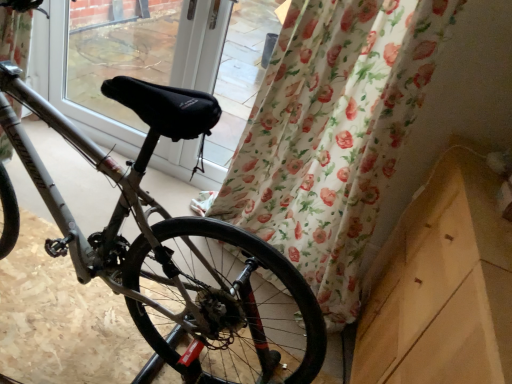
Question: Is floral fabric curtain at lower right surrounded by silver metallic bicycle wheel at lower left?

Choices:
 (A) no
 (B) yes

Answer: (A)

Question: From a real-world perspective, does silver metallic bicycle wheel at lower left sit lower than floral fabric curtain at lower right?

Choices:
 (A) yes
 (B) no

Answer: (A)

Question: Can you confirm if silver metallic bicycle wheel at lower left is taller than floral fabric curtain at lower right?

Choices:
 (A) no
 (B) yes

Answer: (A)

Question: Is silver metallic bicycle wheel at lower left far from floral fabric curtain at lower right?

Choices:
 (A) yes
 (B) no

Answer: (B)

Question: Does silver metallic bicycle wheel at lower left come behind floral fabric curtain at lower right?

Choices:
 (A) yes
 (B) no

Answer: (A)

Question: Is point (217, 61) positioned closer to the camera than point (294, 332)?

Choices:
 (A) farther
 (B) closer

Answer: (A)

Question: Considering the positions of black fabric at center and silver metallic bicycle wheel at lower left in the image, is black fabric at center wider or thinner than silver metallic bicycle wheel at lower left?

Choices:
 (A) thin
 (B) wide

Answer: (A)

Question: From the image's perspective, is black fabric at center positioned above or below silver metallic bicycle wheel at lower left?

Choices:
 (A) above
 (B) below

Answer: (A)

Question: In the image, is black fabric at center on the left side or the right side of silver metallic bicycle wheel at lower left?

Choices:
 (A) right
 (B) left

Answer: (A)

Question: From a real-world perspective, is floral fabric curtain at lower right physically located above or below black fabric at center?

Choices:
 (A) below
 (B) above

Answer: (B)

Question: From the image's perspective, is floral fabric curtain at lower right positioned above or below black fabric at center?

Choices:
 (A) below
 (B) above

Answer: (A)

Question: Considering the positions of floral fabric curtain at lower right and black fabric at center in the image, is floral fabric curtain at lower right wider or thinner than black fabric at center?

Choices:
 (A) thin
 (B) wide

Answer: (B)

Question: Visually, is floral fabric curtain at lower right positioned to the left or to the right of black fabric at center?

Choices:
 (A) right
 (B) left

Answer: (A)

Question: From the image's perspective, is silver metallic bicycle wheel at lower left above or below floral fabric curtain at lower right?

Choices:
 (A) above
 (B) below

Answer: (B)

Question: Does point (242, 349) appear closer or farther from the camera than point (318, 221)?

Choices:
 (A) closer
 (B) farther

Answer: (A)